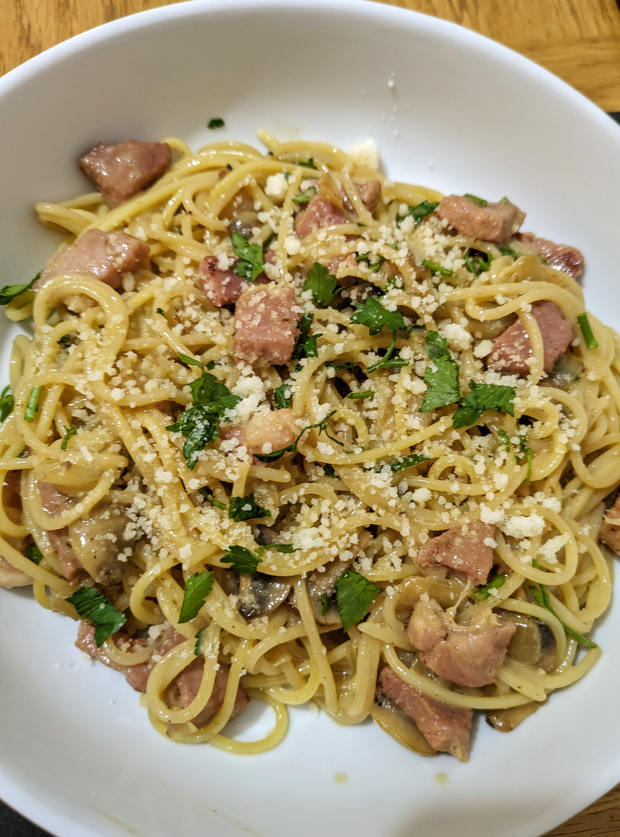
I want to click on surface, so click(591, 828).